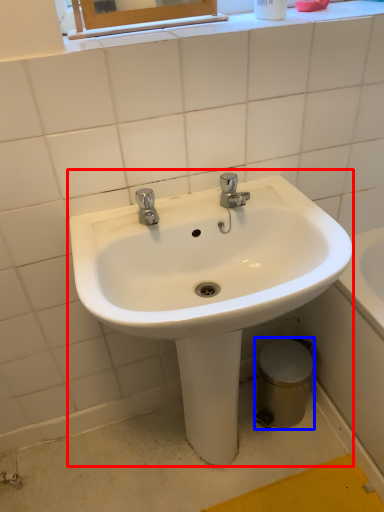
Question: Which object is further to the camera taking this photo, sink (highlighted by a red box) or bidet (highlighted by a blue box)?

Choices:
 (A) sink
 (B) bidet

Answer: (B)